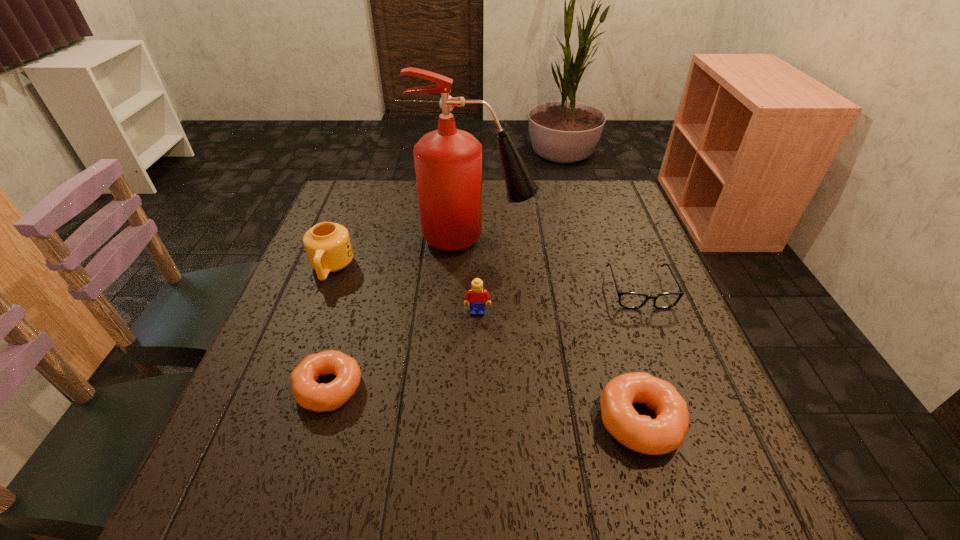
You are a GUI agent. You are given a task and a screenshot of the screen. Output one action in this format:
    pyautogui.click(x=<x>, y=<y>)
    Task: Click on the free space between the spectacles and the right doughnut
    
    Given the screenshot: What is the action you would take?
    pyautogui.click(x=640, y=355)

This screenshot has height=540, width=960. I want to click on free area in between the fire extinguisher and the Lego, so click(x=477, y=275).

The height and width of the screenshot is (540, 960). What are the coordinates of `free space between the tallest object and the spectacles` in the screenshot? It's located at (558, 264).

This screenshot has height=540, width=960. I want to click on free area in between the left doughnut and the taller doughnut, so click(x=485, y=404).

Find the location of a particular element. Image resolution: width=960 pixels, height=540 pixels. vacant space that is in between the mug and the Lego is located at coordinates (404, 290).

This screenshot has width=960, height=540. Find the location of `object that is the second closest one to the spectacles`. object that is the second closest one to the spectacles is located at coordinates (667, 432).

What are the coordinates of `object that can be found as the fifth closest to the shorter doughnut` in the screenshot? It's located at (632, 300).

What are the coordinates of `free space that satisfies the following two spatial constraints: 1. on the handle side of the left doughnut; 2. on the right side of the mug` in the screenshot? It's located at (286, 387).

Find the location of `vacant space that satisfies the following two spatial constraints: 1. on the front-facing side of the right doughnut; 2. on the left side of the Lego`. vacant space that satisfies the following two spatial constraints: 1. on the front-facing side of the right doughnut; 2. on the left side of the Lego is located at coordinates (477, 421).

Identify the location of vacant space that satisfies the following two spatial constraints: 1. with the nozzle aimed from the tallest object; 2. on the handle side of the mug. The height and width of the screenshot is (540, 960). (476, 268).